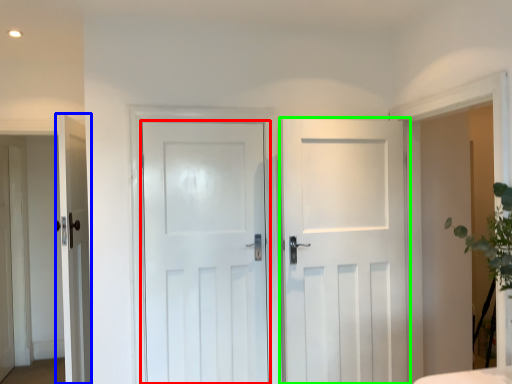
Question: Which object is positioned closest to door (highlighted by a red box)? Select from door (highlighted by a blue box) and door (highlighted by a green box).

Choices:
 (A) door
 (B) door

Answer: (B)